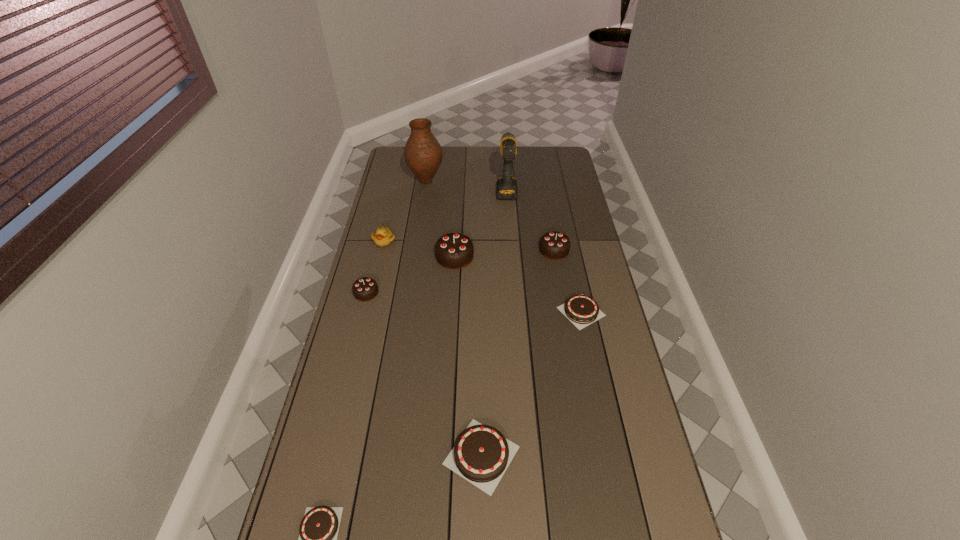
In the image, there is a desktop. Where is `vacant area at the right edge`? The width and height of the screenshot is (960, 540). vacant area at the right edge is located at coordinates (564, 174).

Image resolution: width=960 pixels, height=540 pixels. In order to click on free point between the eighth farthest object and the drill in this screenshot , I will do `click(494, 322)`.

The width and height of the screenshot is (960, 540). Identify the location of vacant space in between the rightmost chocolate chocolate cake and the vase. (490, 215).

Identify the location of free space between the nearest chocolate chocolate cake and the biggest brown chocolate cake. Image resolution: width=960 pixels, height=540 pixels. (424, 374).

You are a GUI agent. You are given a task and a screenshot of the screen. Output one action in this format:
    pyautogui.click(x=<x>, y=<y>)
    Task: Click on the free spot between the vase and the second nearest chocolate cake
    
    Given the screenshot: What is the action you would take?
    pyautogui.click(x=454, y=318)

Select which object appears as the second closest to the second smallest chocolate chocolate cake. Please provide its 2D coordinates. Your answer should be formatted as a tuple, i.e. [(x, y)], where the tuple contains the x and y coordinates of a point satisfying the conditions above.

[(454, 250)]

You are a GUI agent. You are given a task and a screenshot of the screen. Output one action in this format:
    pyautogui.click(x=<x>, y=<y>)
    Task: Click on the object that is the fifth closest to the duckling
    This screenshot has width=960, height=540.
    Given the screenshot: What is the action you would take?
    pyautogui.click(x=554, y=245)

Select which chocolate cake appears as the third closest to the leftmost brown chocolate cake. Please provide its 2D coordinates. Your answer should be formatted as a tuple, i.e. [(x, y)], where the tuple contains the x and y coordinates of a point satisfying the conditions above.

[(581, 310)]

I want to click on chocolate cake that can be found as the closest to the duckling, so click(x=454, y=250).

The image size is (960, 540). Identify the location of chocolate chocolate cake identified as the second closest to the fifth farthest chocolate cake. (454, 250).